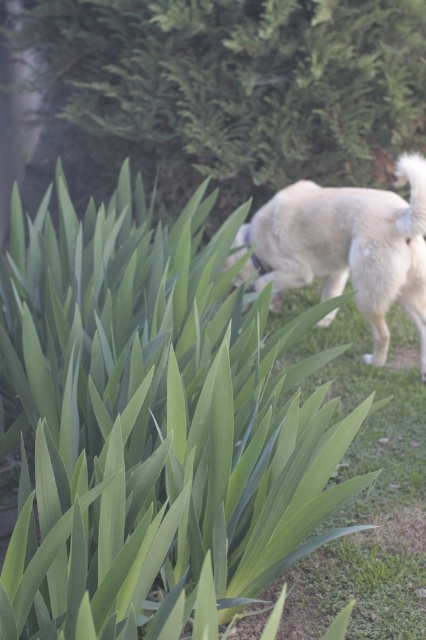
You are standing in a garden and want to water the green leafy plant at upper left. If your watering can has a range of 6 meters, will you be able to reach it without moving closer?

The green leafy plant at upper left is 6.59 meters away from the viewer, which is beyond the watering can range of 6 meters. Therefore, you cannot reach it without moving closer.

You are a photographer trying to capture a clear shot of the white fabric neckband at center. However, the green leafy plant at upper left is blocking your view. Can you move the plant to the right to get a better angle?

The green leafy plant at upper left is positioned on the left side of the white fabric neckband at center. Moving the plant to the right would place it directly in front of the neckband, worsening the obstruction.

You are a gardener looking at the image of a green plant and a dog. You need to determine where the white fluffy dog at right is positioned relative to the white fabric neckband at center. Is it above or below?

The white fluffy dog at right is below the white fabric neckband at center according to the description.